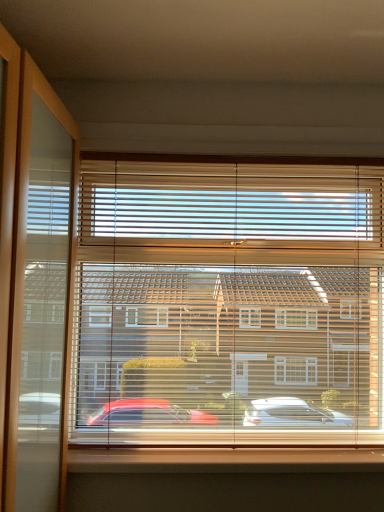
Question: Is wooden blinds at center in front of or behind smooth wood window sill at lower center in the image?

Choices:
 (A) behind
 (B) front

Answer: (A)

Question: From the image's perspective, is wooden blinds at center above or below smooth wood window sill at lower center?

Choices:
 (A) above
 (B) below

Answer: (A)

Question: Considering the positions of wooden blinds at center and smooth wood window sill at lower center in the image, is wooden blinds at center wider or thinner than smooth wood window sill at lower center?

Choices:
 (A) thin
 (B) wide

Answer: (A)

Question: From the image's perspective, is smooth wood window sill at lower center located above or below wooden blinds at center?

Choices:
 (A) below
 (B) above

Answer: (A)

Question: Is smooth wood window sill at lower center spatially inside wooden blinds at center, or outside of it?

Choices:
 (A) outside
 (B) inside

Answer: (B)

Question: In terms of width, does smooth wood window sill at lower center look wider or thinner when compared to wooden blinds at center?

Choices:
 (A) thin
 (B) wide

Answer: (B)

Question: Looking at the image, does smooth wood window sill at lower center seem bigger or smaller compared to wooden blinds at center?

Choices:
 (A) big
 (B) small

Answer: (B)